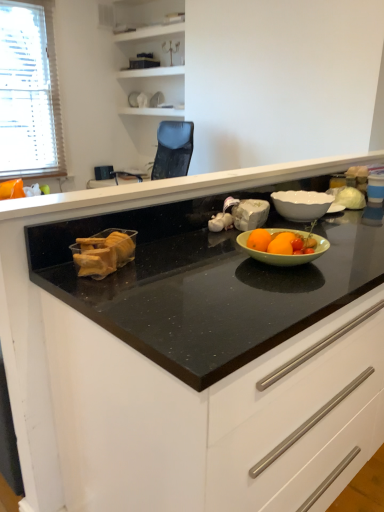
This screenshot has width=384, height=512. Describe the element at coordinates (301, 204) in the screenshot. I see `white glossy bowl at upper right` at that location.

This screenshot has width=384, height=512. What do you see at coordinates (41, 308) in the screenshot? I see `black granite countertop at center` at bounding box center [41, 308].

Locate an element on the screen. translucent plastic baguette at left is located at coordinates (104, 252).

How many degrees apart are the facing directions of white glossy bowl at upper right and translucent plastic baguette at left?

The angle between the facing direction of white glossy bowl at upper right and the facing direction of translucent plastic baguette at left is 0.00108 degrees.

At what (x,y) coordinates should I click in order to perform the action: click on food located underneath the white glossy bowl at upper right (from a real-world perspective). Please return your answer as a coordinate pair (x, y). This screenshot has width=384, height=512. Looking at the image, I should click on (104, 252).

Is white glossy bowl at upper right thinner than translucent plastic baguette at left?

No.

Is white glossy bowl at upper right aimed at translucent plastic baguette at left?

No, white glossy bowl at upper right does not turn towards translucent plastic baguette at left.

Considering their positions, is white blinds at left located in front of or behind black granite countertop at center?

white blinds at left is behind black granite countertop at center.

From the image's perspective, is white blinds at left located above or below black granite countertop at center?

white blinds at left is above black granite countertop at center.

Is white blinds at left with black granite countertop at center?

No, white blinds at left is not next to black granite countertop at center.

Which is behind, point (6, 39) or point (85, 199)?

The point (6, 39) is behind.

Is black granite countertop at center to the left of white blinds at left from the viewer's perspective?

Incorrect, black granite countertop at center is not on the left side of white blinds at left.

Is black granite countertop at center not within white blinds at left?

Yes, black granite countertop at center is outside of white blinds at left.

Is white blinds at left at the back of black granite countertop at center?

That's not correct — black granite countertop at center is not looking away from white blinds at left.

Does black granite countertop at center have a greater width compared to translucent plastic baguette at left?

Correct, the width of black granite countertop at center exceeds that of translucent plastic baguette at left.

Would you say black granite countertop at center contains translucent plastic baguette at left?

That's incorrect, translucent plastic baguette at left is not inside black granite countertop at center.

From the image's perspective, is black granite countertop at center on translucent plastic baguette at left?

Yes.

Where is `countertop located above the translucent plastic baguette at left (from the image's perspective)`? This screenshot has width=384, height=512. countertop located above the translucent plastic baguette at left (from the image's perspective) is located at coordinates (170, 189).

Would you say translucent plastic baguette at left is a long distance from black granite countertop at center?

That's not correct — translucent plastic baguette at left is a little close to black granite countertop at center.

From a real-world perspective, between translucent plastic baguette at left and black granite countertop at center, who is vertically lower?

In real-world perspective, translucent plastic baguette at left is lower.

Between translucent plastic baguette at left and black granite countertop at center, which one has less height?

With less height is black granite countertop at center.

Is translucent plastic baguette at left to the right of black granite countertop at center from the viewer's perspective?

No.

Considering the points (277, 207) and (171, 189), which point is behind, point (277, 207) or point (171, 189)?

The point (277, 207) is farther from the camera.

From a real-world perspective, does white glossy bowl at upper right stand above black granite countertop at center?

No.

Is white glossy bowl at upper right aimed at black granite countertop at center?

No, white glossy bowl at upper right is not oriented towards black granite countertop at center.

Is white glossy bowl at upper right wider or thinner than white blinds at left?

white glossy bowl at upper right is wider than white blinds at left.

Considering the positions of objects white glossy bowl at upper right and white blinds at left in the image provided, who is more to the right, white glossy bowl at upper right or white blinds at left?

white glossy bowl at upper right.

Is white glossy bowl at upper right located outside white blinds at left?

Yes, white glossy bowl at upper right is not within white blinds at left.

Locate an element on the screen. The image size is (384, 512). window lying on the left of white glossy bowl at upper right is located at coordinates (29, 92).

Find the location of a particular element. The image size is (384, 512). food located in front of the white glossy bowl at upper right is located at coordinates (104, 252).

You are a GUI agent. You are given a task and a screenshot of the screen. Output one action in this format:
    pyautogui.click(x=<x>, y=<y>)
    Task: Click on the countertop that appears on the right of white blinds at left
    The image size is (384, 512).
    Given the screenshot: What is the action you would take?
    pyautogui.click(x=170, y=189)

Considering their positions, is black granite countertop at center positioned closer to white glossy bowl at upper right than black granite countertop at center?

The object closer to white glossy bowl at upper right is black granite countertop at center.

From the picture: When comparing their distances from translucent plastic baguette at left, does black granite countertop at center or white blinds at left seem closer?

black granite countertop at center is closer to translucent plastic baguette at left.

Looking at the image, which one is located closer to black granite countertop at center, translucent plastic baguette at left or black granite countertop at center?

black granite countertop at center.

Estimate the real-world distances between objects in this image. Which object is closer to white blinds at left, translucent plastic baguette at left or black granite countertop at center?

black granite countertop at center is closer to white blinds at left.

From the picture: Estimate the real-world distances between objects in this image. Which object is closer to translucent plastic baguette at left, white blinds at left or black granite countertop at center?

black granite countertop at center is closer to translucent plastic baguette at left.

Looking at the image, which one is located further to white glossy bowl at upper right, black granite countertop at center or white blinds at left?

Among the two, white blinds at left is located further to white glossy bowl at upper right.

Which object lies nearer to the anchor point black granite countertop at center, black granite countertop at center or translucent plastic baguette at left?

black granite countertop at center is positioned closer to the anchor black granite countertop at center.

From the image, which object appears to be nearer to black granite countertop at center, white blinds at left or black granite countertop at center?

black granite countertop at center is positioned closer to the anchor black granite countertop at center.

I want to click on countertop between translucent plastic baguette at left and black granite countertop at center, so click(170, 189).

This screenshot has width=384, height=512. Identify the location of bowl between black granite countertop at center and white blinds at left in the front-back direction. (301, 204).

Find the location of a particular element. Image resolution: width=384 pixels, height=512 pixels. bowl positioned between translucent plastic baguette at left and white blinds at left from near to far is located at coordinates (301, 204).

The height and width of the screenshot is (512, 384). What are the coordinates of `food between black granite countertop at center and white blinds at left along the z-axis` in the screenshot? It's located at (104, 252).